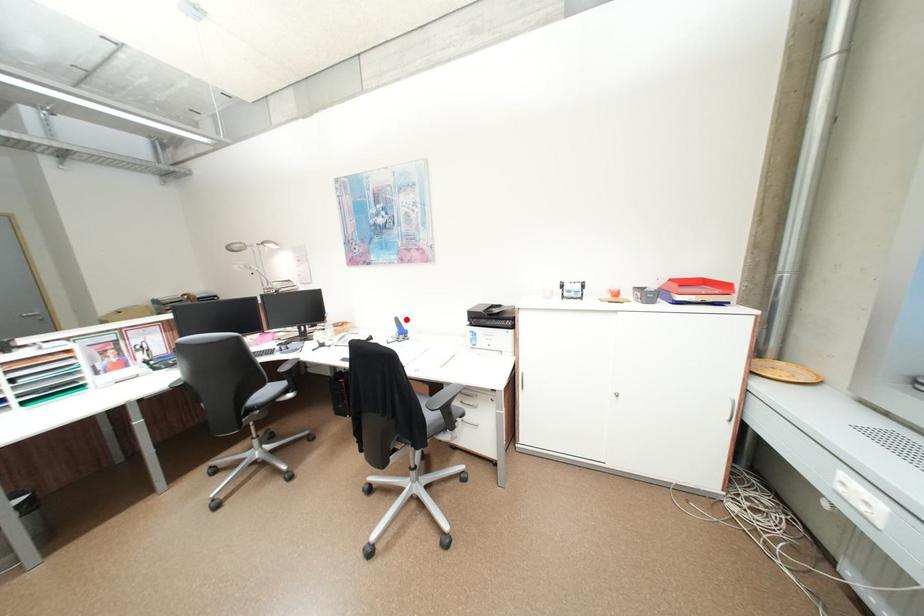
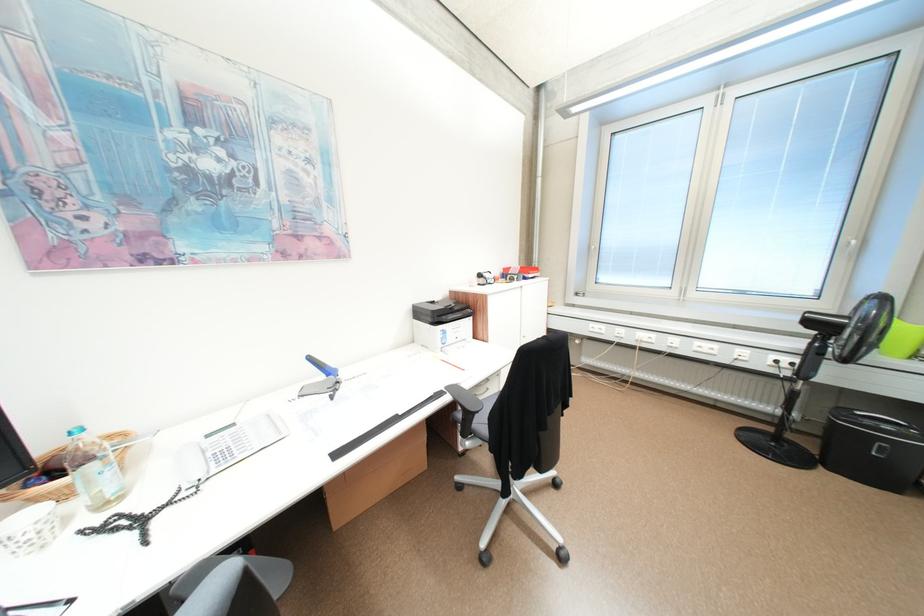
Question: I am providing you with two images of the same scene from different viewpoints. In image1, a red point is highlighted. Considering the same 3D point in image2, which of the following is correct?

Choices:
 (A) It is closer
 (B) It is farther

Answer: (A)